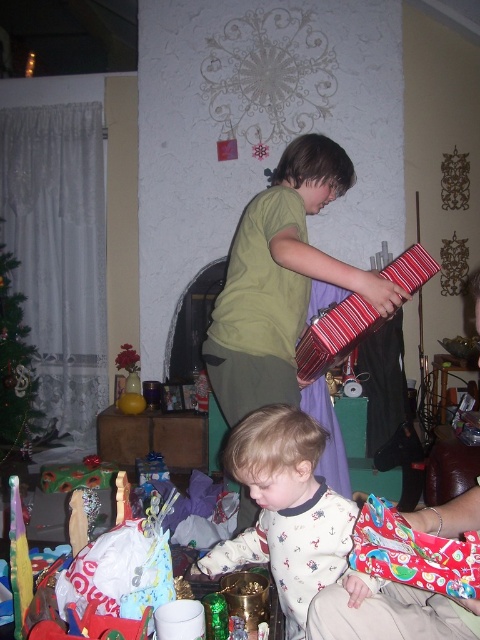
Question: Which is nearer to the white soft pajamas at lower center?

Choices:
 (A) printed fabric wrapped gift at lower right
 (B) green matte christmas tree at left

Answer: (A)

Question: Can you confirm if white soft pajamas at lower center is thinner than printed fabric wrapped gift at lower right?

Choices:
 (A) no
 (B) yes

Answer: (A)

Question: Estimate the real-world distances between objects in this image. Which object is farther from the white soft pajamas at lower center?

Choices:
 (A) printed fabric wrapped gift at lower right
 (B) green matte christmas tree at left

Answer: (B)

Question: Which object appears farthest from the camera in this image?

Choices:
 (A) matte red suitcase at center
 (B) white soft pajamas at lower center
 (C) green matte christmas tree at left

Answer: (C)

Question: Does white soft pajamas at lower center appear on the left side of matte red suitcase at center?

Choices:
 (A) yes
 (B) no

Answer: (A)

Question: Can you confirm if white soft pajamas at lower center is positioned to the right of matte red suitcase at center?

Choices:
 (A) no
 (B) yes

Answer: (A)